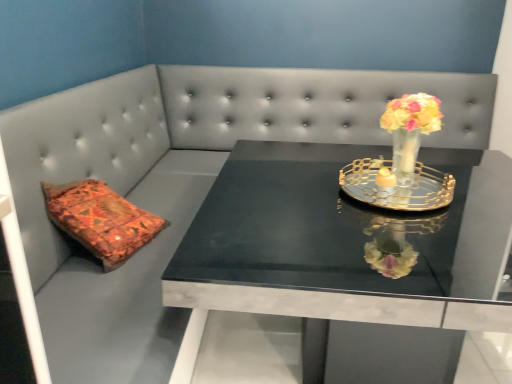
Identify the location of vacant space positioned to the left of gold metallic tray at center. (294, 193).